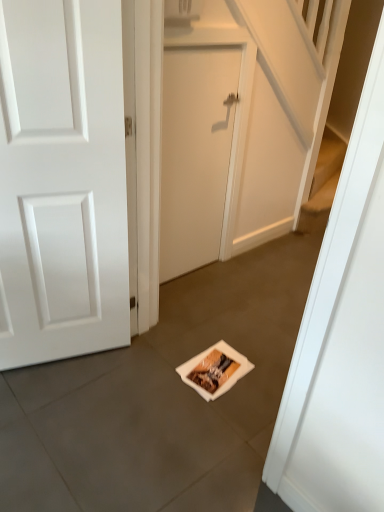
What is the approximate height of white matte door at left, placed as the second door when sorted from right to left?

1.40 meters.

Locate an element on the screen. This screenshot has width=384, height=512. white matte door at left, arranged as the 1th door when viewed from the left is located at coordinates (62, 181).

Image resolution: width=384 pixels, height=512 pixels. Describe the element at coordinates (62, 181) in the screenshot. I see `white matte door at left, arranged as the 1th door when viewed from the left` at that location.

Identify the location of beige matte door at center, which is counted as the 1th door, starting from the right. (195, 154).

The image size is (384, 512). What do you see at coordinates (195, 154) in the screenshot? I see `beige matte door at center, which is counted as the 1th door, starting from the right` at bounding box center [195, 154].

The width and height of the screenshot is (384, 512). I want to click on white matte door at left, arranged as the 1th door when viewed from the left, so click(62, 181).

Is white matte door at left, placed as the second door when sorted from right to left, to the left or to the right of beige matte door at center, positioned as the second door in left-to-right order, in the image?

Clearly, white matte door at left, placed as the second door when sorted from right to left, is on the left of beige matte door at center, positioned as the second door in left-to-right order, in the image.

Is the depth of white matte door at left, placed as the second door when sorted from right to left, greater than that of beige matte door at center, positioned as the second door in left-to-right order?

No.

Which is in front, point (120, 29) or point (189, 89)?

The point (120, 29) is closer.

From the image's perspective, is white matte door at left, arranged as the 1th door when viewed from the left, on beige matte door at center, which is counted as the 1th door, starting from the right?

Incorrect, from the image's perspective, white matte door at left, arranged as the 1th door when viewed from the left, is lower than beige matte door at center, which is counted as the 1th door, starting from the right.

From a real-world perspective, between white matte door at left, placed as the second door when sorted from right to left, and beige matte door at center, which is counted as the 1th door, starting from the right, who is vertically higher?

white matte door at left, placed as the second door when sorted from right to left, from a real-world perspective.

Based on the photo, considering the relative sizes of white matte door at left, arranged as the 1th door when viewed from the left, and beige matte door at center, which is counted as the 1th door, starting from the right, in the image provided, is white matte door at left, arranged as the 1th door when viewed from the left, thinner than beige matte door at center, which is counted as the 1th door, starting from the right,?

No, white matte door at left, arranged as the 1th door when viewed from the left, is not thinner than beige matte door at center, which is counted as the 1th door, starting from the right.

Can you confirm if white matte door at left, placed as the second door when sorted from right to left, is taller than beige matte door at center, positioned as the second door in left-to-right order?

Correct, white matte door at left, placed as the second door when sorted from right to left, is much taller as beige matte door at center, positioned as the second door in left-to-right order.

Looking at this image, considering the sizes of white matte door at left, arranged as the 1th door when viewed from the left, and beige matte door at center, which is counted as the 1th door, starting from the right, in the image, is white matte door at left, arranged as the 1th door when viewed from the left, bigger or smaller than beige matte door at center, which is counted as the 1th door, starting from the right,?

In the image, white matte door at left, arranged as the 1th door when viewed from the left, appears to be larger than beige matte door at center, which is counted as the 1th door, starting from the right.

Is beige matte door at center, positioned as the second door in left-to-right order, completely or partially inside white matte door at left, placed as the second door when sorted from right to left?

No, beige matte door at center, positioned as the second door in left-to-right order, is not a part of white matte door at left, placed as the second door when sorted from right to left.

Is white matte door at left, placed as the second door when sorted from right to left, touching beige matte door at center, which is counted as the 1th door, starting from the right?

white matte door at left, placed as the second door when sorted from right to left, and beige matte door at center, which is counted as the 1th door, starting from the right, are not in contact.

Could you tell me if white matte door at left, arranged as the 1th door when viewed from the left, is turned towards beige matte door at center, positioned as the second door in left-to-right order?

No, white matte door at left, arranged as the 1th door when viewed from the left, is not turned towards beige matte door at center, positioned as the second door in left-to-right order.

Can you tell me how much white matte door at left, placed as the second door when sorted from right to left, and beige matte door at center, positioned as the second door in left-to-right order, differ in facing direction?

19.2 degrees.

How distant is white matte door at left, placed as the second door when sorted from right to left, from beige matte door at center, which is counted as the 1th door, starting from the right?

A distance of 26.04 inches exists between white matte door at left, placed as the second door when sorted from right to left, and beige matte door at center, which is counted as the 1th door, starting from the right.

Where is `door below the beige matte door at center, which is counted as the 1th door, starting from the right (from the image's perspective)`? The height and width of the screenshot is (512, 384). door below the beige matte door at center, which is counted as the 1th door, starting from the right (from the image's perspective) is located at coordinates (62, 181).

Is beige matte door at center, positioned as the second door in left-to-right order, to the left of white matte door at left, placed as the second door when sorted from right to left, from the viewer's perspective?

Incorrect, beige matte door at center, positioned as the second door in left-to-right order, is not on the left side of white matte door at left, placed as the second door when sorted from right to left.

Consider the image. Considering the positions of objects beige matte door at center, which is counted as the 1th door, starting from the right, and white matte door at left, placed as the second door when sorted from right to left, in the image provided, who is in front, beige matte door at center, which is counted as the 1th door, starting from the right, or white matte door at left, placed as the second door when sorted from right to left,?

white matte door at left, placed as the second door when sorted from right to left, is closer to the camera.

Is point (174, 254) behind point (119, 24)?

Yes, point (174, 254) is farther from viewer.

From the image's perspective, which one is positioned lower, beige matte door at center, which is counted as the 1th door, starting from the right, or white matte door at left, placed as the second door when sorted from right to left?

white matte door at left, placed as the second door when sorted from right to left.

From a real-world perspective, is beige matte door at center, positioned as the second door in left-to-right order, located beneath white matte door at left, placed as the second door when sorted from right to left?

Yes, from a real-world perspective, beige matte door at center, positioned as the second door in left-to-right order, is beneath white matte door at left, placed as the second door when sorted from right to left.

Considering the sizes of objects beige matte door at center, positioned as the second door in left-to-right order, and white matte door at left, placed as the second door when sorted from right to left, in the image provided, who is wider, beige matte door at center, positioned as the second door in left-to-right order, or white matte door at left, placed as the second door when sorted from right to left,?

white matte door at left, placed as the second door when sorted from right to left.

Considering the sizes of objects beige matte door at center, positioned as the second door in left-to-right order, and white matte door at left, arranged as the 1th door when viewed from the left, in the image provided, who is taller, beige matte door at center, positioned as the second door in left-to-right order, or white matte door at left, arranged as the 1th door when viewed from the left,?

white matte door at left, arranged as the 1th door when viewed from the left.

Does beige matte door at center, which is counted as the 1th door, starting from the right, have a larger size compared to white matte door at left, placed as the second door when sorted from right to left?

No, beige matte door at center, which is counted as the 1th door, starting from the right, is not bigger than white matte door at left, placed as the second door when sorted from right to left.

Consider the image. Is beige matte door at center, positioned as the second door in left-to-right order, completely or partially outside of white matte door at left, arranged as the 1th door when viewed from the left?

Indeed, beige matte door at center, positioned as the second door in left-to-right order, is completely outside white matte door at left, arranged as the 1th door when viewed from the left.

Is beige matte door at center, positioned as the second door in left-to-right order, placed right next to white matte door at left, arranged as the 1th door when viewed from the left?

No, beige matte door at center, positioned as the second door in left-to-right order, is not touching white matte door at left, arranged as the 1th door when viewed from the left.

Could you tell me if beige matte door at center, positioned as the second door in left-to-right order, is turned towards white matte door at left, arranged as the 1th door when viewed from the left?

No, beige matte door at center, positioned as the second door in left-to-right order, is not aimed at white matte door at left, arranged as the 1th door when viewed from the left.

What's the angular difference between beige matte door at center, which is counted as the 1th door, starting from the right, and white matte door at left, arranged as the 1th door when viewed from the left,'s facing directions?

beige matte door at center, which is counted as the 1th door, starting from the right, and white matte door at left, arranged as the 1th door when viewed from the left, are facing 19.2 degrees away from each other.

How far apart are beige matte door at center, which is counted as the 1th door, starting from the right, and white matte door at left, arranged as the 1th door when viewed from the left?

beige matte door at center, which is counted as the 1th door, starting from the right, and white matte door at left, arranged as the 1th door when viewed from the left, are 26.04 inches apart from each other.

This screenshot has height=512, width=384. Find the location of `door that appears above the beige matte door at center, positioned as the second door in left-to-right order (from a real-world perspective)`. door that appears above the beige matte door at center, positioned as the second door in left-to-right order (from a real-world perspective) is located at coordinates (62, 181).

Where is `door that is behind the white matte door at left, placed as the second door when sorted from right to left`? The width and height of the screenshot is (384, 512). door that is behind the white matte door at left, placed as the second door when sorted from right to left is located at coordinates click(195, 154).

Image resolution: width=384 pixels, height=512 pixels. Find the location of `door below the beige matte door at center, which is counted as the 1th door, starting from the right (from the image's perspective)`. door below the beige matte door at center, which is counted as the 1th door, starting from the right (from the image's perspective) is located at coordinates (62, 181).